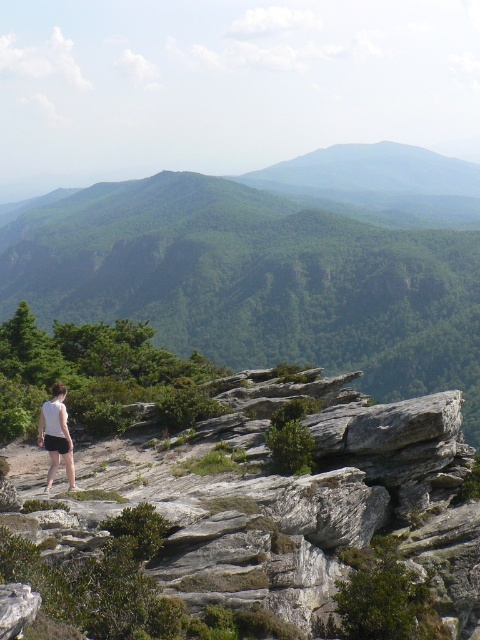
Is green grassy mountain at upper center behind white fabric shorts at lower left?

Yes.

Is green grassy mountain at upper center smaller than white fabric shorts at lower left?

No.

Who is more distant from viewer, (323, 172) or (56, 387)?

The point (323, 172) is more distant.

Identify the location of green grassy mountain at upper center. (374, 170).

Does green leafy mountain at center appear on the right side of green grassy mountain at upper center?

In fact, green leafy mountain at center is to the left of green grassy mountain at upper center.

Who is positioned more to the left, green leafy mountain at center or green grassy mountain at upper center?

green leafy mountain at center is more to the left.

Does point (104, 285) lie behind point (457, 157)?

No, it is in front of (457, 157).

Locate an element on the screen. Image resolution: width=480 pixels, height=640 pixels. green leafy mountain at center is located at coordinates (275, 264).

Can you confirm if green leafy mountain at center is taller than white cotton shorts at lower left?

Yes.

Can you confirm if green leafy mountain at center is thinner than white cotton shorts at lower left?

No, green leafy mountain at center is not thinner than white cotton shorts at lower left.

Between point (361, 161) and point (54, 444), which one is positioned in front?

Point (54, 444)

You are a GUI agent. You are given a task and a screenshot of the screen. Output one action in this format:
    pyautogui.click(x=<x>, y=<y>)
    Task: Click on the green leafy mountain at center
    Image resolution: width=480 pixels, height=640 pixels.
    Given the screenshot: What is the action you would take?
    pyautogui.click(x=275, y=264)